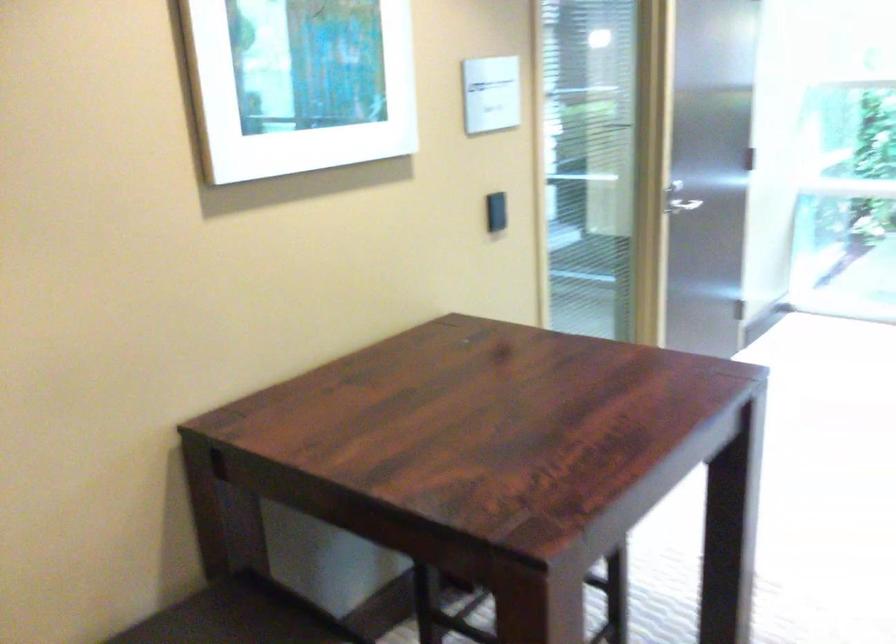
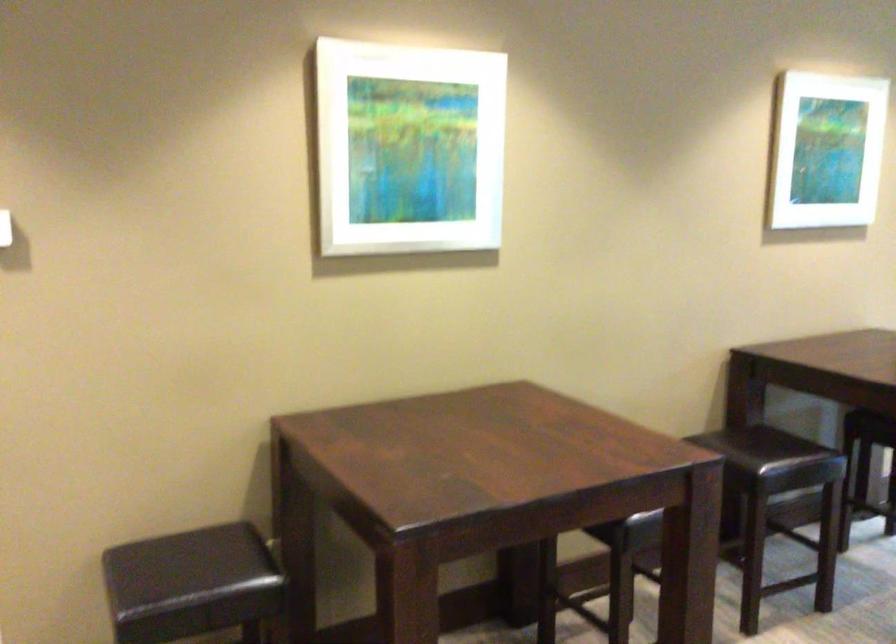
Find the pixel in the second image that matches the point at 282,69 in the first image.

(824, 149)